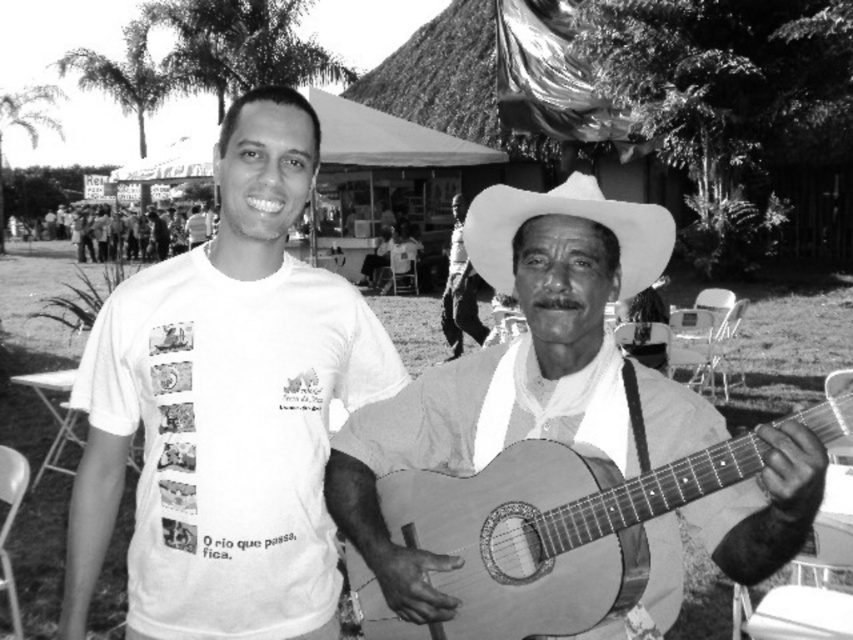
Is wooden acoustic guitar at center in front of white felt sombrero at center?

That is True.

Is wooden acoustic guitar at center taller than white felt sombrero at center?

Correct, wooden acoustic guitar at center is much taller as white felt sombrero at center.

Is point (642, 576) in front of point (670, 228)?

Yes, point (642, 576) is closer to viewer.

The height and width of the screenshot is (640, 853). What are the coordinates of `wooden acoustic guitar at center` in the screenshot? It's located at (534, 536).

Between white cotton t-shirt at center and matte white shirt at center, which one has less height?

With less height is white cotton t-shirt at center.

The image size is (853, 640). I want to click on white cotton t-shirt at center, so pos(225,408).

Who is more forward, (479,204) or (190,220)?

Point (479,204) is in front.

Measure the distance between white felt sombrero at center and camera.

They are 1.99 meters apart.

Identify the location of white felt sombrero at center. (569, 216).

I want to click on white felt sombrero at center, so click(569, 216).